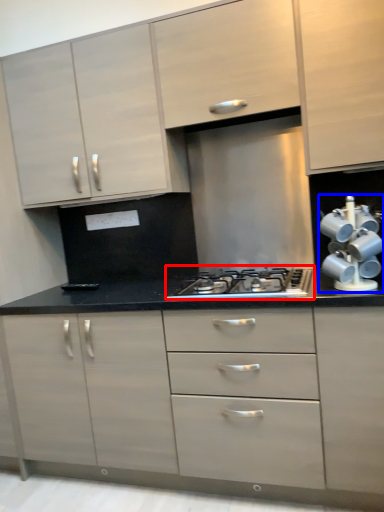
Question: Which object is closer to the camera taking this photo, gas stove (highlighted by a red box) or appliance (highlighted by a blue box)?

Choices:
 (A) gas stove
 (B) appliance

Answer: (B)